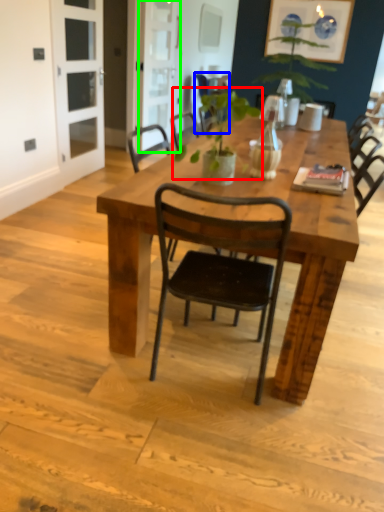
Question: Considering the real-world distances, which object is farthest from plant (highlighted by a red box)? chair (highlighted by a blue box) or screen door (highlighted by a green box)?

Choices:
 (A) chair
 (B) screen door

Answer: (B)